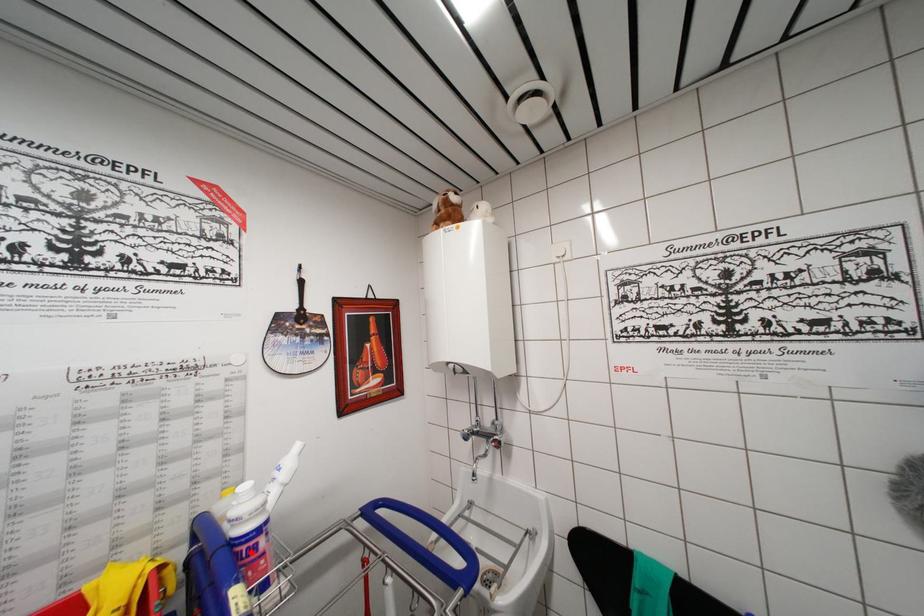
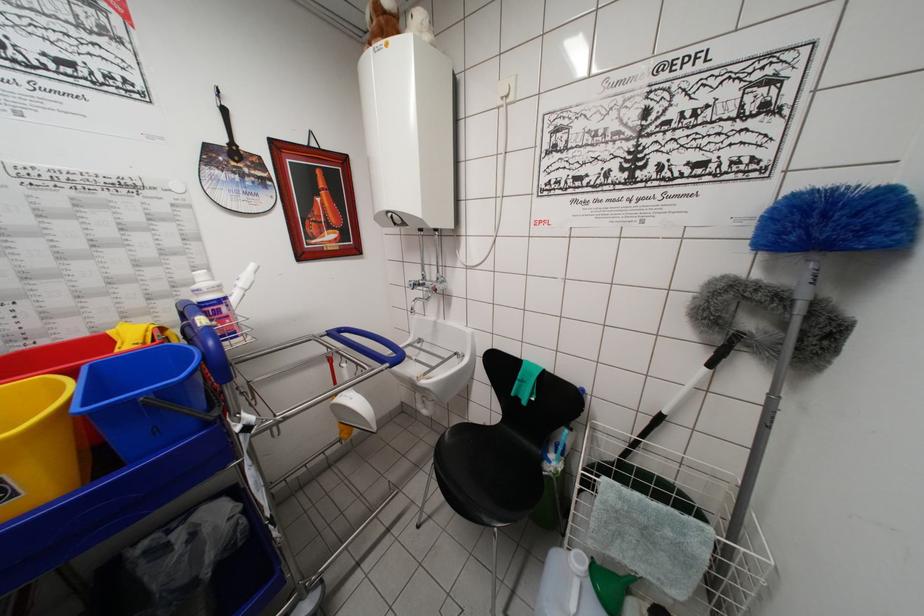
The point at the highlighted location is marked in the first image. Where is the corresponding point in the second image?

(215, 315)